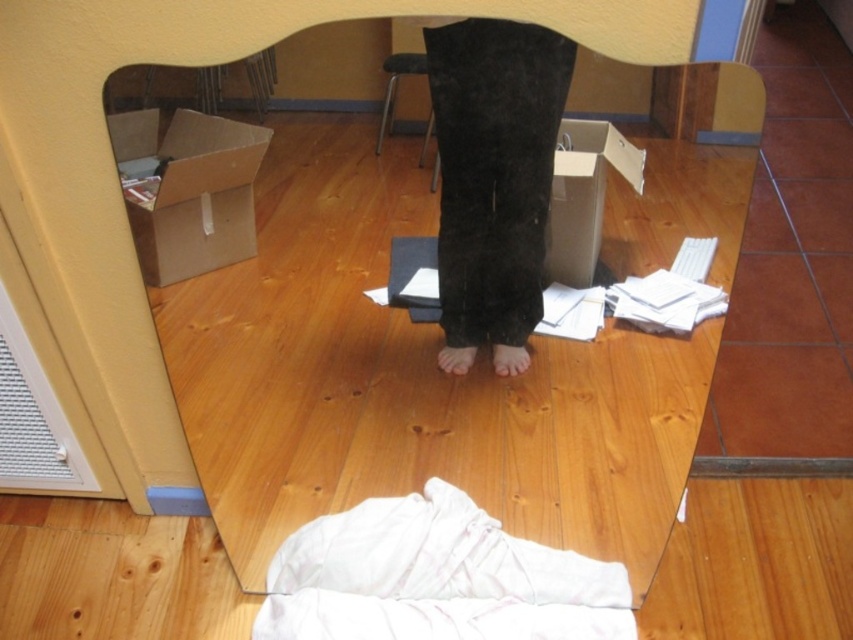
Question: Among these objects, which one is farthest from the camera?

Choices:
 (A) brown cardboard box at left
 (B) barefoot at center
 (C) pink matte skin at center
 (D) metallic silver stool at center

Answer: (B)

Question: Is brown cardboard box at left positioned behind metallic silver stool at center?

Choices:
 (A) no
 (B) yes

Answer: (B)

Question: Which point is closer to the camera?

Choices:
 (A) (511, 346)
 (B) (461, 372)
 (C) (164, 141)
 (D) (387, 128)

Answer: (D)

Question: Is metallic silver stool at center bigger than barefoot at center?

Choices:
 (A) yes
 (B) no

Answer: (A)

Question: Does pink matte skin at center lie behind barefoot at center?

Choices:
 (A) yes
 (B) no

Answer: (B)

Question: Which object is closer to the camera taking this photo?

Choices:
 (A) brown cardboard box at left
 (B) metallic silver stool at center

Answer: (B)